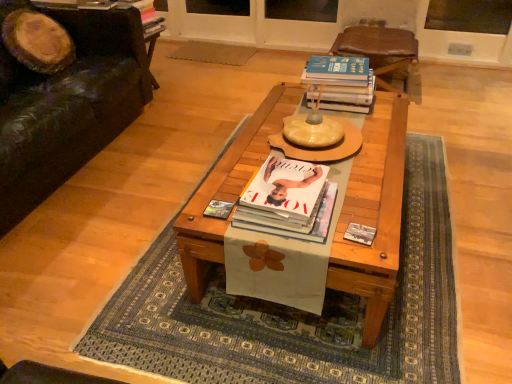
I want to click on free spot to the left of gray matte paperback book at center, so click(x=321, y=243).